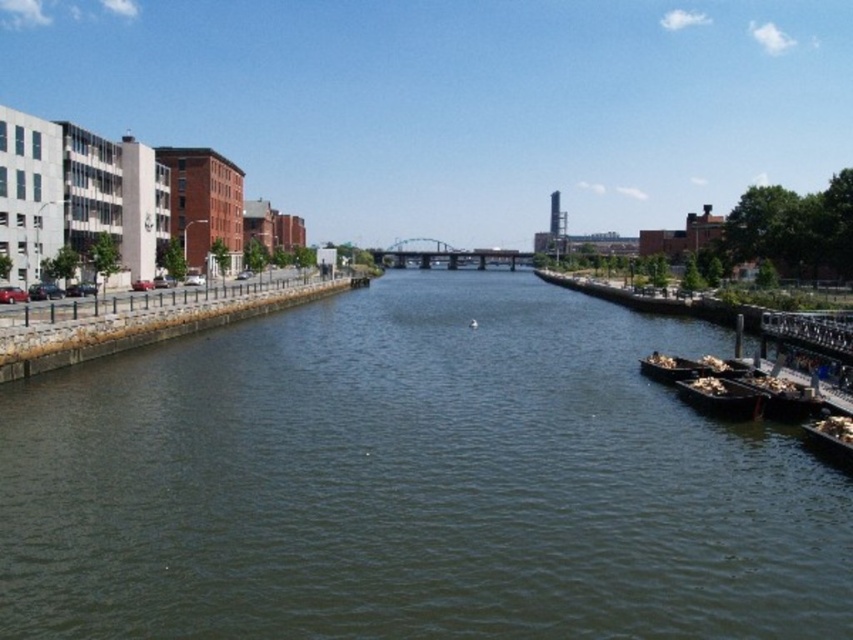
Question: Which is nearer to the dark brown wooden boat at lower right?

Choices:
 (A) wooden boat at lower right
 (B) wooden boat at right
 (C) wooden planks at right
 (D) dark green water at center

Answer: (C)

Question: Is dark brown wooden boat at lower right smaller than wooden planks at right?

Choices:
 (A) no
 (B) yes

Answer: (B)

Question: Is dark green water at center below wooden boat at lower right?

Choices:
 (A) no
 (B) yes

Answer: (A)

Question: Which object appears closest to the camera in this image?

Choices:
 (A) dark brown wooden boat at lower right
 (B) wooden boat at right

Answer: (A)

Question: Can you confirm if wooden planks at right is positioned below wooden boat at lower right?

Choices:
 (A) no
 (B) yes

Answer: (A)

Question: Which object appears closest to the camera in this image?

Choices:
 (A) wooden boat at lower right
 (B) dark green water at center

Answer: (B)